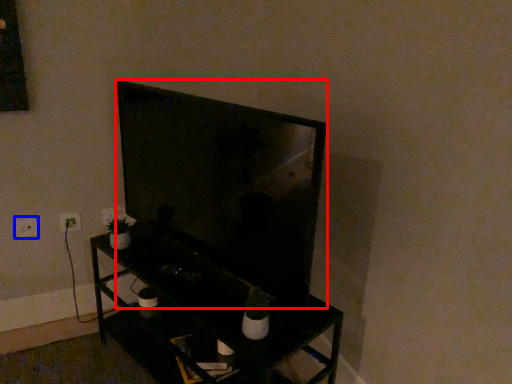
Question: Which object appears closest to the camera in this image, television (highlighted by a red box) or electric outlet (highlighted by a blue box)?

Choices:
 (A) television
 (B) electric outlet

Answer: (A)